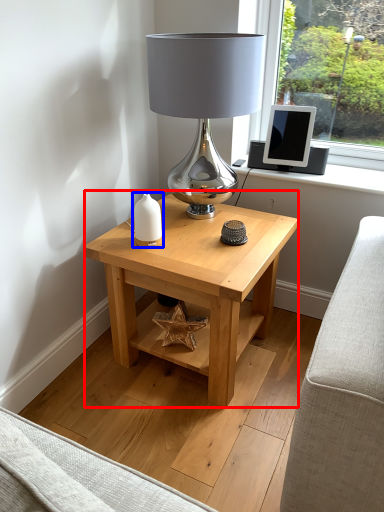
Question: Which point is closer to the camera, table (highlighted by a red box) or candle holder (highlighted by a blue box)?

Choices:
 (A) table
 (B) candle holder

Answer: (A)